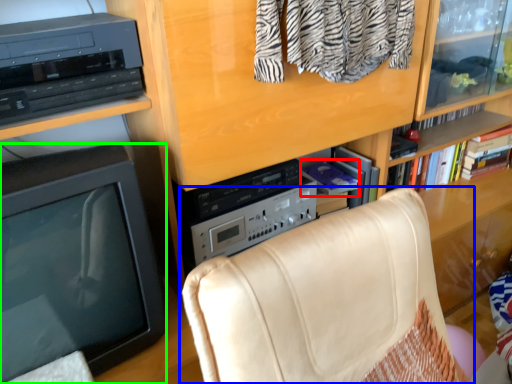
Question: Which is nearer to the book (highlighted by a red box)? chair (highlighted by a blue box) or television (highlighted by a green box).

Choices:
 (A) chair
 (B) television

Answer: (A)